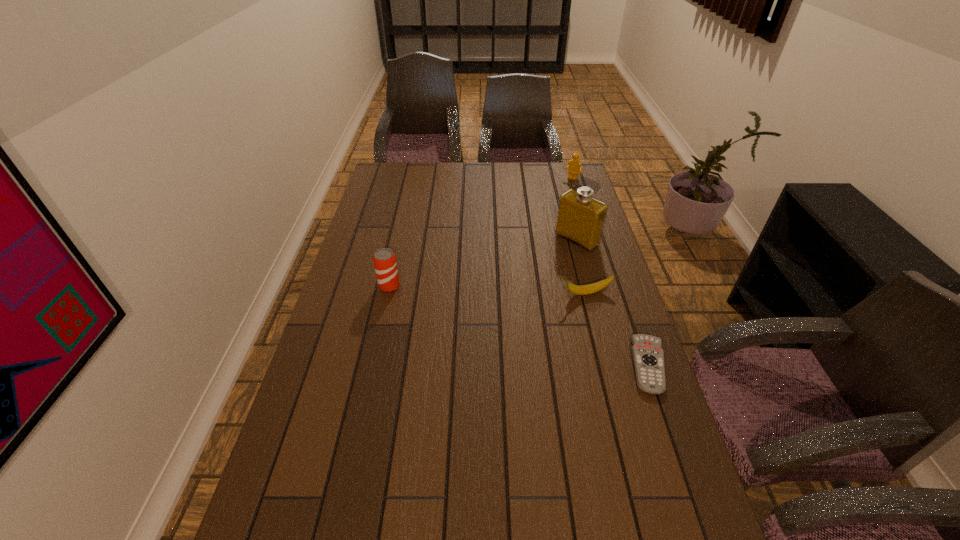
Find the location of a particular element. vacant space on the desktop that is between the beer can and the shortest object and is positioned at the stem of the banana is located at coordinates (478, 313).

What are the coordinates of `free space on the desktop that is between the beer can and the shortest object and is positioned on the front-facing side of the perfume` in the screenshot? It's located at (481, 314).

I want to click on vacant spot on the desktop that is between the leftmost object and the shortest object and is positioned on the face of the farthest object, so click(474, 312).